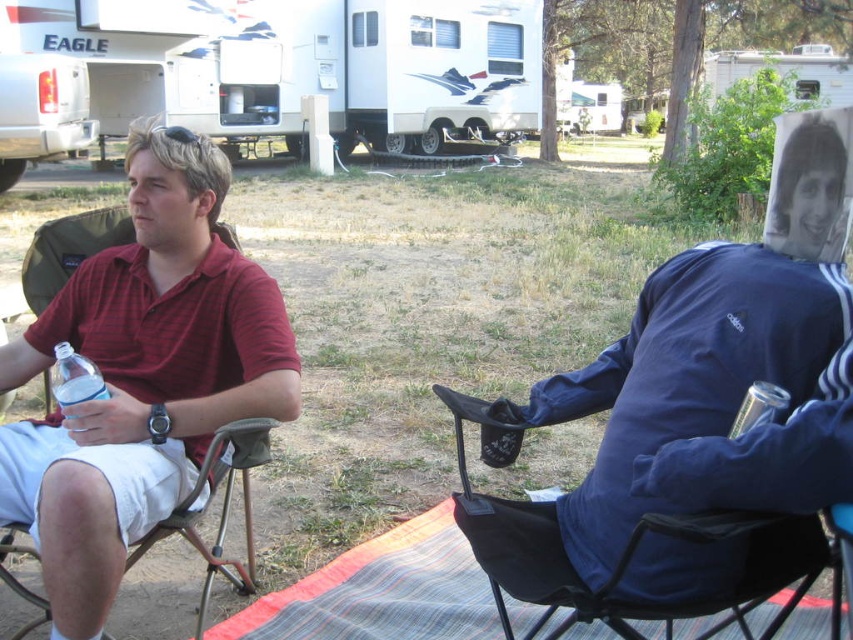
You are setting up a picnic and need to place a clear plastic cup at lower right. Where should you put it so that it doesn not fall off the black fabric chair at right?

The clear plastic cup at lower right should be placed on the black fabric chair at right since the black fabric chair at right is positioned under it, providing a stable surface to prevent it from falling.

You are planning to take a photo of the matte red shirt at left and the white glossy recreational vehicle at upper center. Which object should you focus on first if you want to capture both in the same frame without moving the camera?

The matte red shirt at left is to the right of the white glossy recreational vehicle at upper center, so you should focus on the white glossy recreational vehicle at upper center first to ensure both are in the frame.